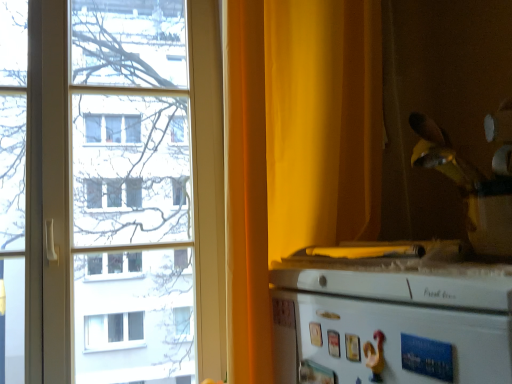
Question: Can you confirm if white glossy refrigerator at lower right is positioned to the left of transparent glass window at left?

Choices:
 (A) no
 (B) yes

Answer: (A)

Question: From the image's perspective, is white glossy refrigerator at lower right located beneath transparent glass window at left?

Choices:
 (A) no
 (B) yes

Answer: (B)

Question: Does white glossy refrigerator at lower right have a larger size compared to transparent glass window at left?

Choices:
 (A) no
 (B) yes

Answer: (A)

Question: Considering the relative sizes of white glossy refrigerator at lower right and transparent glass window at left in the image provided, is white glossy refrigerator at lower right wider than transparent glass window at left?

Choices:
 (A) yes
 (B) no

Answer: (B)

Question: Can you confirm if white glossy refrigerator at lower right is positioned to the right of transparent glass window at left?

Choices:
 (A) no
 (B) yes

Answer: (B)

Question: From the image's perspective, is white glossy refrigerator at lower right located above or below transparent glass window at left?

Choices:
 (A) above
 (B) below

Answer: (B)

Question: Considering the positions of white glossy refrigerator at lower right and transparent glass window at left in the image, is white glossy refrigerator at lower right wider or thinner than transparent glass window at left?

Choices:
 (A) wide
 (B) thin

Answer: (B)

Question: Based on their positions, is white glossy refrigerator at lower right located to the left or right of transparent glass window at left?

Choices:
 (A) left
 (B) right

Answer: (B)

Question: From their relative heights in the image, would you say white glossy refrigerator at lower right is taller or shorter than transparent glass window at left?

Choices:
 (A) short
 (B) tall

Answer: (A)

Question: Considering the positions of transparent glass window at left and white glossy refrigerator at lower right in the image, is transparent glass window at left bigger or smaller than white glossy refrigerator at lower right?

Choices:
 (A) big
 (B) small

Answer: (A)

Question: From the image's perspective, is transparent glass window at left located above or below white glossy refrigerator at lower right?

Choices:
 (A) below
 (B) above

Answer: (B)

Question: Considering the positions of transparent glass window at left and white glossy refrigerator at lower right in the image, is transparent glass window at left wider or thinner than white glossy refrigerator at lower right?

Choices:
 (A) wide
 (B) thin

Answer: (A)

Question: Is point (181, 379) closer or farther from the camera than point (329, 319)?

Choices:
 (A) farther
 (B) closer

Answer: (A)

Question: Is white glossy refrigerator at lower right spatially inside yellow fabric curtain at right, or outside of it?

Choices:
 (A) inside
 (B) outside

Answer: (B)

Question: Based on their sizes in the image, would you say white glossy refrigerator at lower right is bigger or smaller than yellow fabric curtain at right?

Choices:
 (A) big
 (B) small

Answer: (B)